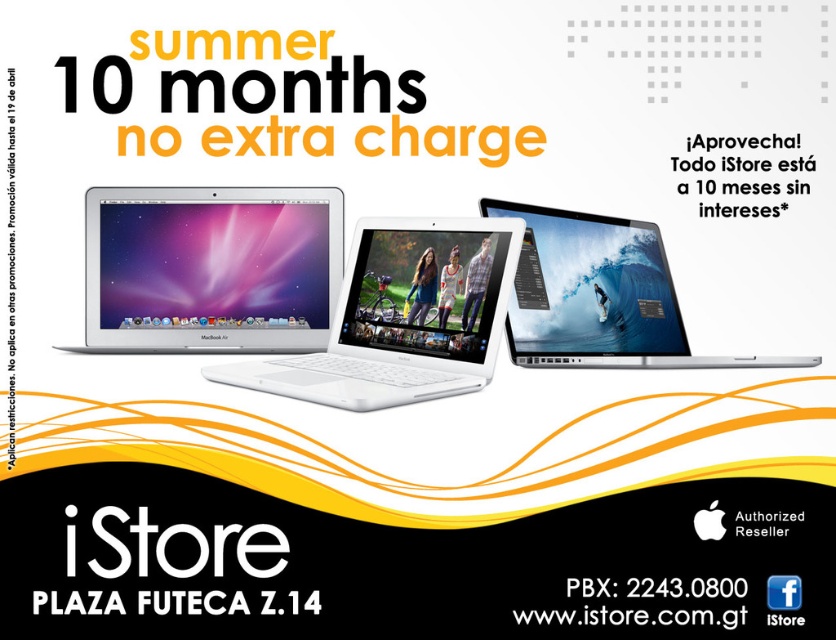
Question: Considering the real-world distances, which object is farthest from the sleek silver laptop at center?

Choices:
 (A) satin silver macbook air at center
 (B) white glossy laptop at center

Answer: (A)

Question: Which point is farther from the camera taking this photo?

Choices:
 (A) (487, 224)
 (B) (90, 305)

Answer: (B)

Question: Is the position of white glossy laptop at center more distant than that of sleek silver laptop at center?

Choices:
 (A) no
 (B) yes

Answer: (A)

Question: Is satin silver macbook air at center thinner than sleek silver laptop at center?

Choices:
 (A) no
 (B) yes

Answer: (B)

Question: Can you confirm if satin silver macbook air at center is positioned to the left of sleek silver laptop at center?

Choices:
 (A) no
 (B) yes

Answer: (B)

Question: Which object is closer to the camera taking this photo?

Choices:
 (A) sleek silver laptop at center
 (B) satin silver macbook air at center
 (C) white glossy laptop at center

Answer: (C)